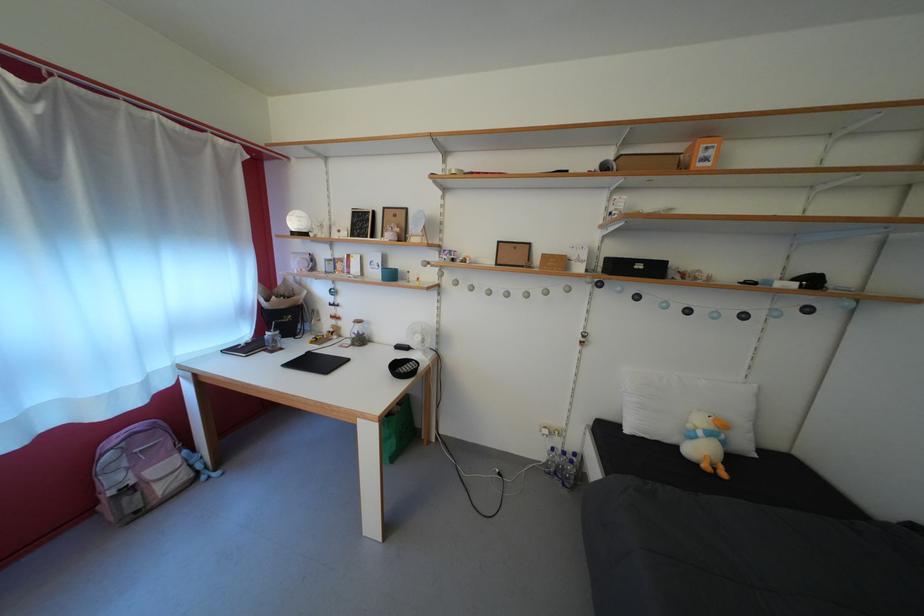
Find where to lift the clear glass jar. Please return your answer as a coordinate pair (x, y).

(359, 333)